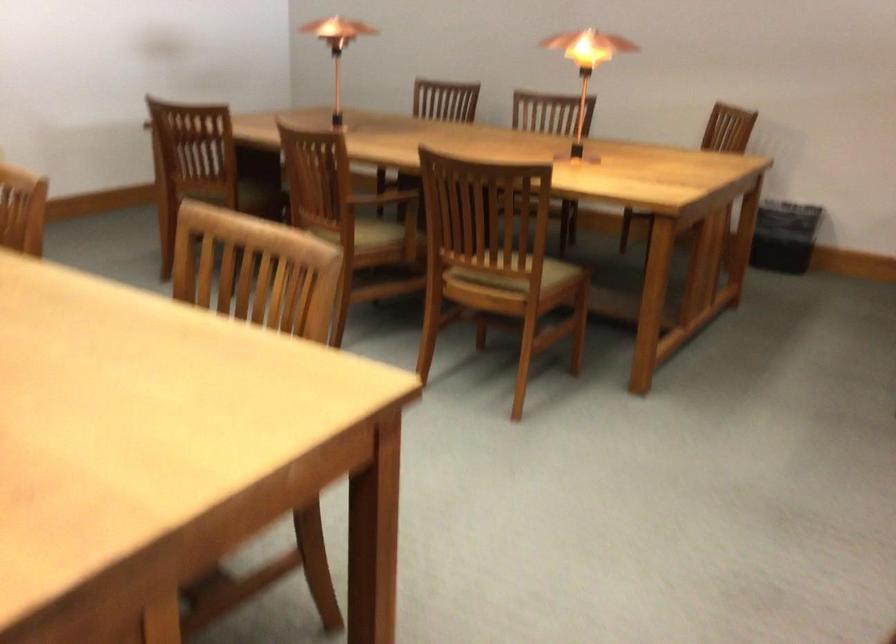
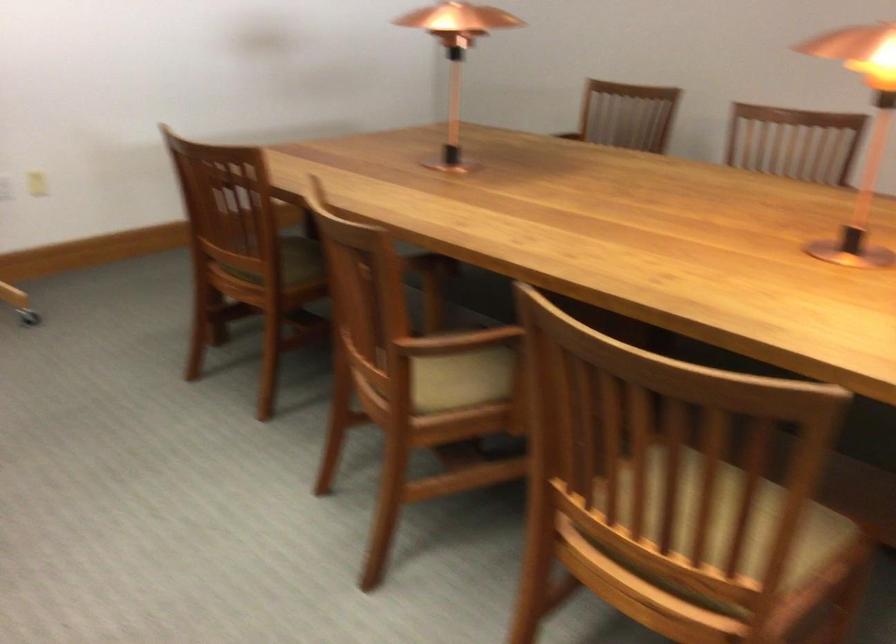
Where in the second image is the point corresponding to the point at 524,242 from the first image?

(728, 526)